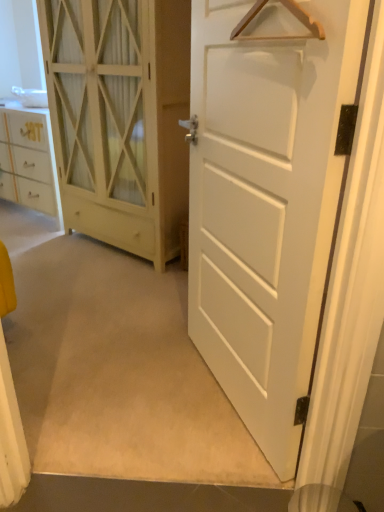
Question: Is the depth of white wood cabinet at left, placed as the first door when sorted from back to front, less than that of wooden hanger at upper center?

Choices:
 (A) yes
 (B) no

Answer: (B)

Question: Can you confirm if white wood cabinet at left, placed as the first door when sorted from back to front, is wider than wooden hanger at upper center?

Choices:
 (A) yes
 (B) no

Answer: (A)

Question: From the image's perspective, does white wood cabinet at left, placed as the first door when sorted from back to front, appear lower than wooden hanger at upper center?

Choices:
 (A) no
 (B) yes

Answer: (A)

Question: Can you confirm if white wood cabinet at left, placed as the first door when sorted from back to front, is positioned to the right of wooden hanger at upper center?

Choices:
 (A) no
 (B) yes

Answer: (A)

Question: Considering the relative sizes of white wood cabinet at left, placed as the first door when sorted from back to front, and wooden hanger at upper center in the image provided, is white wood cabinet at left, placed as the first door when sorted from back to front, shorter than wooden hanger at upper center?

Choices:
 (A) yes
 (B) no

Answer: (B)

Question: Is point tap(286, 26) closer or farther from the camera than point tap(264, 0)?

Choices:
 (A) farther
 (B) closer

Answer: (B)

Question: From the image's perspective, relative to wooden hanger at upper center, is white matte door at center, which appears as the 1th door when viewed from the front, above or below?

Choices:
 (A) above
 (B) below

Answer: (B)

Question: In the image, is white matte door at center, the second door from the back, positioned in front of or behind wooden hanger at upper center?

Choices:
 (A) behind
 (B) front

Answer: (A)

Question: Is white matte door at center, the second door from the back, taller or shorter than wooden hanger at upper center?

Choices:
 (A) tall
 (B) short

Answer: (A)

Question: Is point (279, 261) closer or farther from the camera than point (94, 179)?

Choices:
 (A) farther
 (B) closer

Answer: (B)

Question: From the image's perspective, is white matte door at center, the second door from the back, positioned above or below white wood cabinet at left, placed as the first door when sorted from back to front?

Choices:
 (A) below
 (B) above

Answer: (A)

Question: From a real-world perspective, is white matte door at center, the second door from the back, physically located above or below white wood cabinet at left, the 2th door viewed from the front?

Choices:
 (A) above
 (B) below

Answer: (B)

Question: Is white matte door at center, which appears as the 1th door when viewed from the front, inside or outside of white wood cabinet at left, the 2th door viewed from the front?

Choices:
 (A) outside
 (B) inside

Answer: (A)

Question: From the image's perspective, is wooden hanger at upper center located above or below white matte door at center, the second door from the back?

Choices:
 (A) below
 (B) above

Answer: (B)

Question: Relative to white matte door at center, which appears as the 1th door when viewed from the front, is wooden hanger at upper center in front or behind?

Choices:
 (A) front
 (B) behind

Answer: (A)